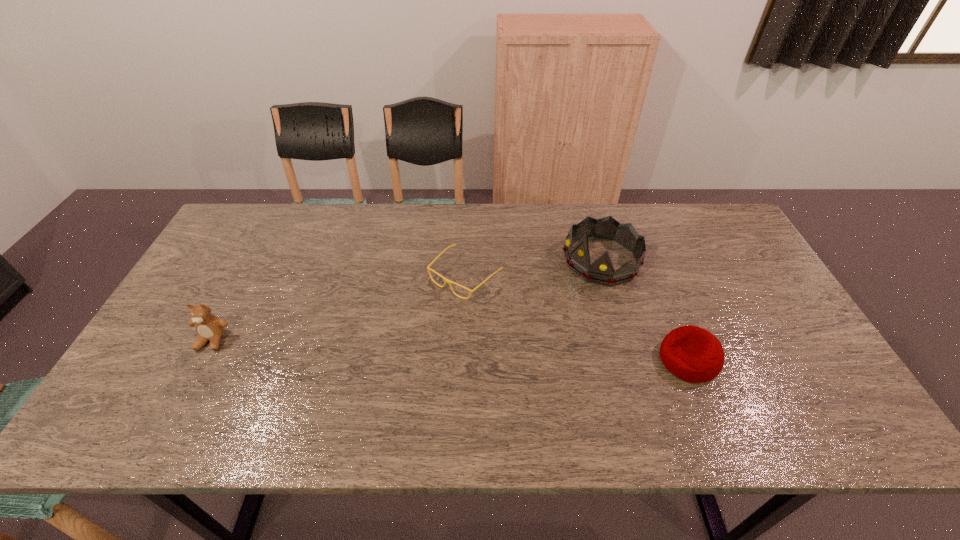
Where is `free spot that satisfies the following two spatial constraints: 1. on the back side of the tiara; 2. on the right side of the spectacles`? free spot that satisfies the following two spatial constraints: 1. on the back side of the tiara; 2. on the right side of the spectacles is located at coordinates (467, 260).